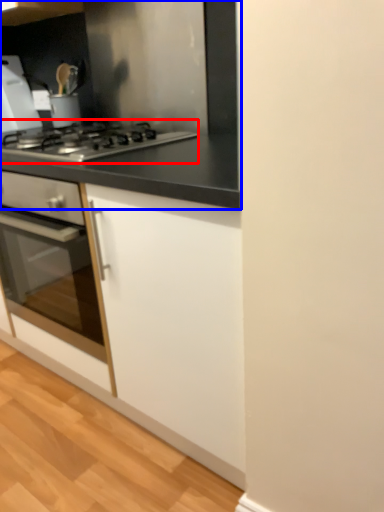
Question: Which object appears farthest to the camera in this image, gas stove (highlighted by a red box) or countertop (highlighted by a blue box)?

Choices:
 (A) gas stove
 (B) countertop

Answer: (B)